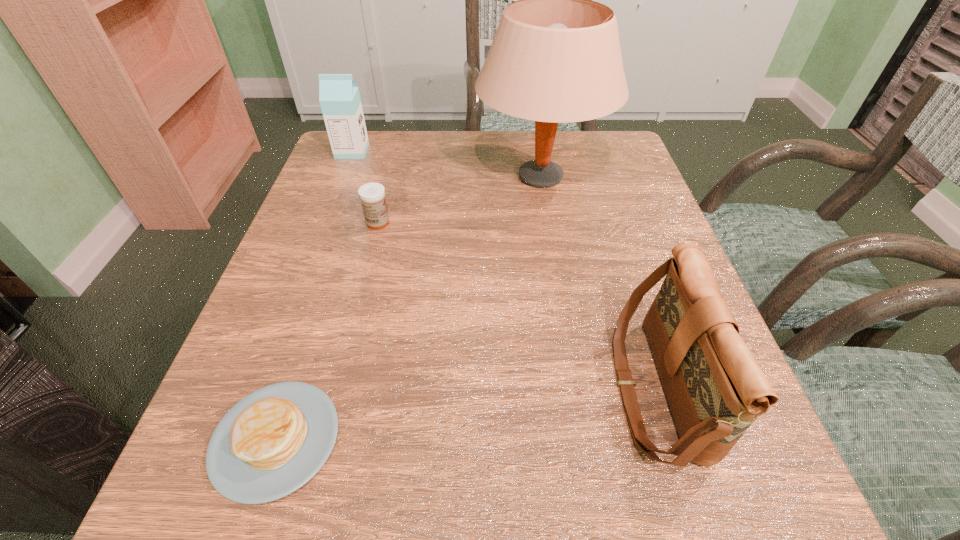
Locate an element on the screen. The image size is (960, 540). vacant space in between the shortest object and the milk carton is located at coordinates (314, 295).

Where is `unoccupied position between the shoulder bag and the milk carton`? unoccupied position between the shoulder bag and the milk carton is located at coordinates (504, 270).

Identify the location of free space between the shortest object and the shoulder bag. (466, 414).

Identify the location of free space between the milk carton and the shoulder bag. The height and width of the screenshot is (540, 960). (504, 270).

The height and width of the screenshot is (540, 960). In order to click on free spot between the shoulder bag and the tallest object in this screenshot , I will do `click(598, 283)`.

You are a GUI agent. You are given a task and a screenshot of the screen. Output one action in this format:
    pyautogui.click(x=<x>, y=<y>)
    Task: Click on the empty space between the milk carton and the shoulder bag
    
    Given the screenshot: What is the action you would take?
    pyautogui.click(x=504, y=270)

Locate an element on the screen. free spot between the lampshade and the medicine is located at coordinates (459, 200).

The width and height of the screenshot is (960, 540). In order to click on free space between the shoulder bag and the pancake in this screenshot , I will do tap(466, 414).

You are a GUI agent. You are given a task and a screenshot of the screen. Output one action in this format:
    pyautogui.click(x=<x>, y=<y>)
    Task: Click on the vacant space that's between the shoulder bag and the milk carton
    
    Given the screenshot: What is the action you would take?
    pyautogui.click(x=504, y=270)

This screenshot has width=960, height=540. Find the location of `free space between the second shortest object and the shortest object`. free space between the second shortest object and the shortest object is located at coordinates (327, 331).